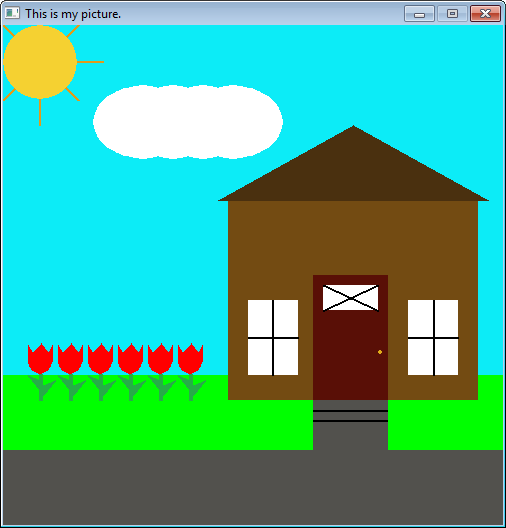
The width and height of the screenshot is (506, 528). Find the location of `window`. window is located at coordinates (290, 320), (416, 313), (352, 304).